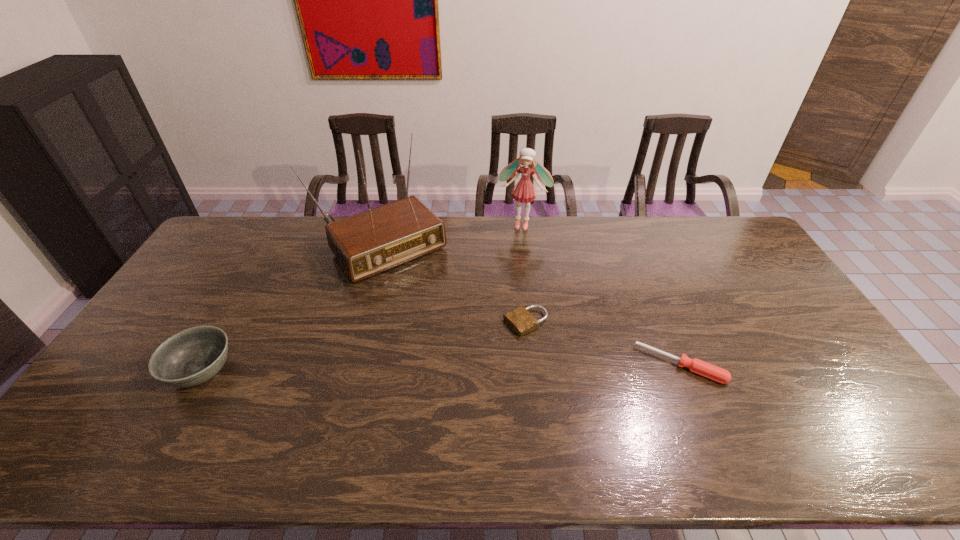
The width and height of the screenshot is (960, 540). In order to click on the leftmost object in this screenshot , I will do (x=191, y=357).

This screenshot has width=960, height=540. Find the location of `bowl`. bowl is located at coordinates [x=191, y=357].

This screenshot has height=540, width=960. What are the coordinates of `screwdriver` in the screenshot? It's located at (705, 369).

The image size is (960, 540). In order to click on the rightmost object in this screenshot , I will do `click(705, 369)`.

At what (x,y) coordinates should I click in order to perform the action: click on the third farthest object. Please return your answer as a coordinate pair (x, y). This screenshot has height=540, width=960. Looking at the image, I should click on (520, 319).

Identify the location of padlock. This screenshot has width=960, height=540. (520, 319).

Where is `the fourth object from right to left`? The width and height of the screenshot is (960, 540). the fourth object from right to left is located at coordinates (368, 243).

I want to click on doll, so [524, 191].

You are a GUI agent. You are given a task and a screenshot of the screen. Output one action in this format:
    pyautogui.click(x=<x>, y=<y>)
    Task: Click on the vacant space located on the left of the bowl
    
    Given the screenshot: What is the action you would take?
    pyautogui.click(x=142, y=372)

What are the coordinates of `vacant space situated 0.170m on the back of the rightmost object` in the screenshot? It's located at (655, 303).